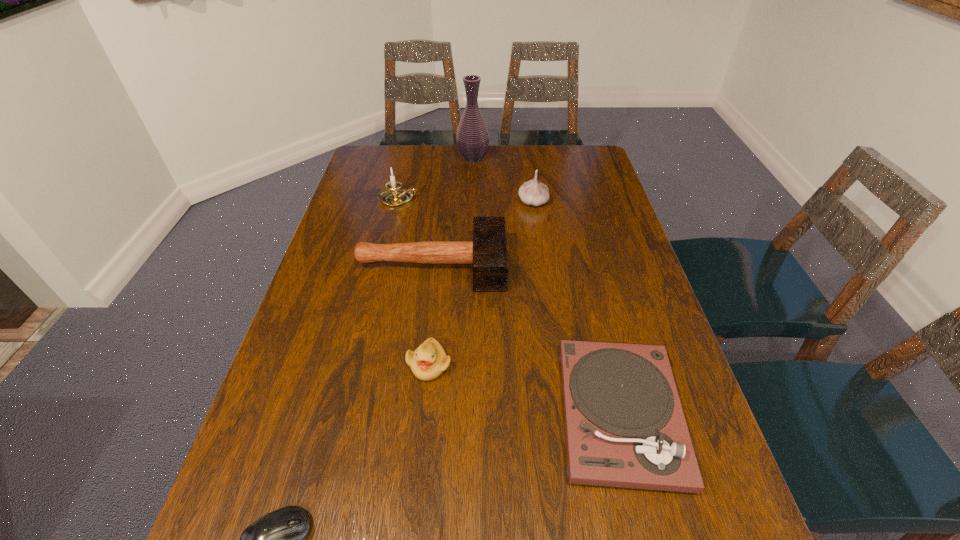
The height and width of the screenshot is (540, 960). I want to click on vase, so click(472, 138).

Identify the location of the farthest object. (472, 138).

The image size is (960, 540). Identify the location of garlic. (534, 192).

Find the location of a particular element. The height and width of the screenshot is (540, 960). candle holder is located at coordinates (393, 196).

At what (x,y) coordinates should I click in order to perform the action: click on the fourth nearest object. Please return your answer as a coordinate pair (x, y). Looking at the image, I should click on (488, 253).

I want to click on duckling, so click(x=429, y=360).

Image resolution: width=960 pixels, height=540 pixels. In order to click on phonograph_record in this screenshot , I will do `click(625, 427)`.

You are a GUI agent. You are given a task and a screenshot of the screen. Output one action in this format:
    pyautogui.click(x=<x>, y=<y>)
    Task: Click on the blank space located 0.180m on the front of the tallest object
    This screenshot has width=960, height=540.
    Given the screenshot: What is the action you would take?
    pyautogui.click(x=472, y=194)

Locate an element on the screen. The width and height of the screenshot is (960, 540). vacant region located 0.320m on the left of the garlic is located at coordinates (420, 202).

Identify the location of free space located 0.270m on the handle side of the candle holder. (501, 199).